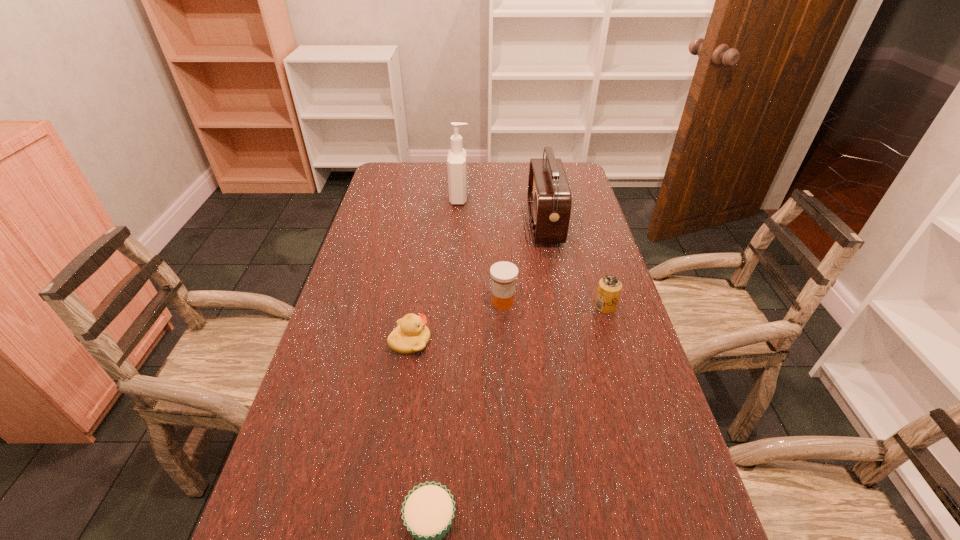
Where is `free space at the right edge of the desktop`? free space at the right edge of the desktop is located at coordinates (586, 350).

What are the coordinates of `free space between the cleansing agent and the beer can` in the screenshot? It's located at (532, 252).

This screenshot has width=960, height=540. What are the coordinates of `free point between the duckling and the rightmost object` in the screenshot? It's located at click(x=508, y=324).

Where is `free space that is in between the cleansing agent and the second object from right to left`? This screenshot has width=960, height=540. free space that is in between the cleansing agent and the second object from right to left is located at coordinates (502, 211).

Identify the location of vacant area between the fourth object from left to right and the rightmost object. (554, 305).

The image size is (960, 540). Find the location of `free space between the fifth shortest object and the cleansing agent`. free space between the fifth shortest object and the cleansing agent is located at coordinates (502, 211).

I want to click on vacant region between the fifth object from left to right and the beer can, so click(x=575, y=265).

In order to click on vacant area that lies between the fifth tallest object and the fifth object from left to right in this screenshot , I will do `click(477, 283)`.

You are a GUI agent. You are given a task and a screenshot of the screen. Output one action in this format:
    pyautogui.click(x=<x>, y=<y>)
    Task: Click on the object that is the fourth closest to the second nearest object
    
    Given the screenshot: What is the action you would take?
    pyautogui.click(x=609, y=288)

At what (x,y) coordinates should I click in order to perform the action: click on object that is the third closest to the third object from right to left. Please return your answer as a coordinate pair (x, y). This screenshot has height=540, width=960. Looking at the image, I should click on (609, 288).